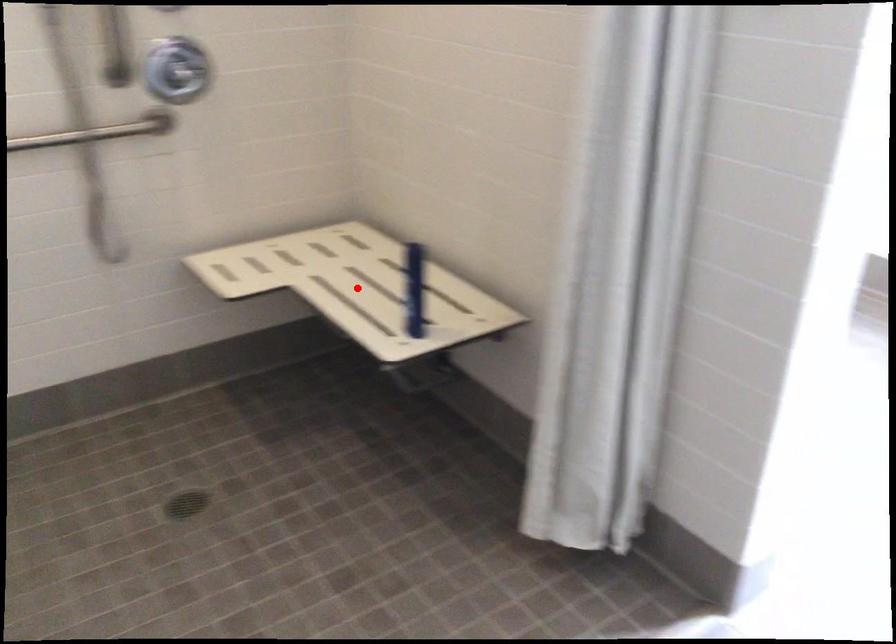
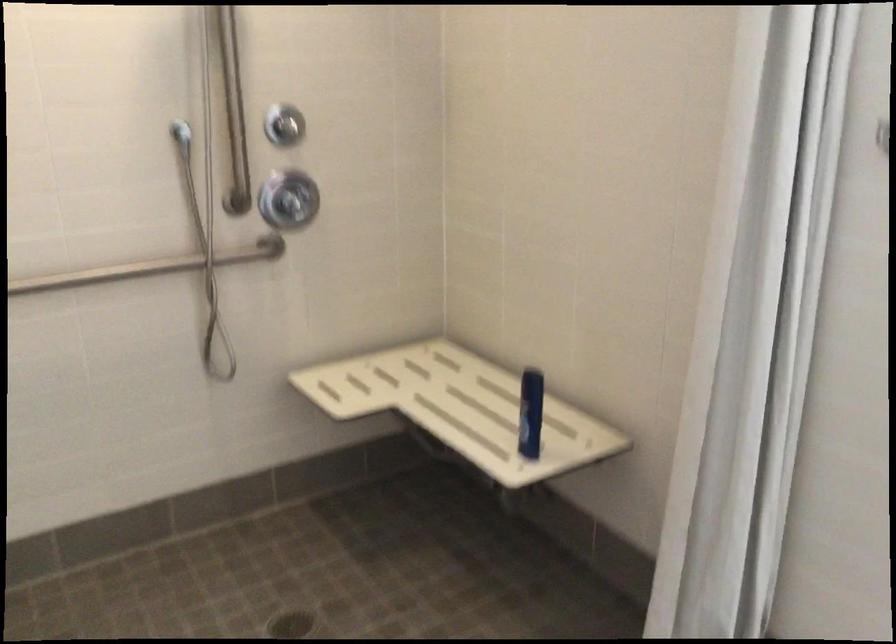
Where in the second image is the point corresponding to the highlighted location from the first image?

(460, 408)